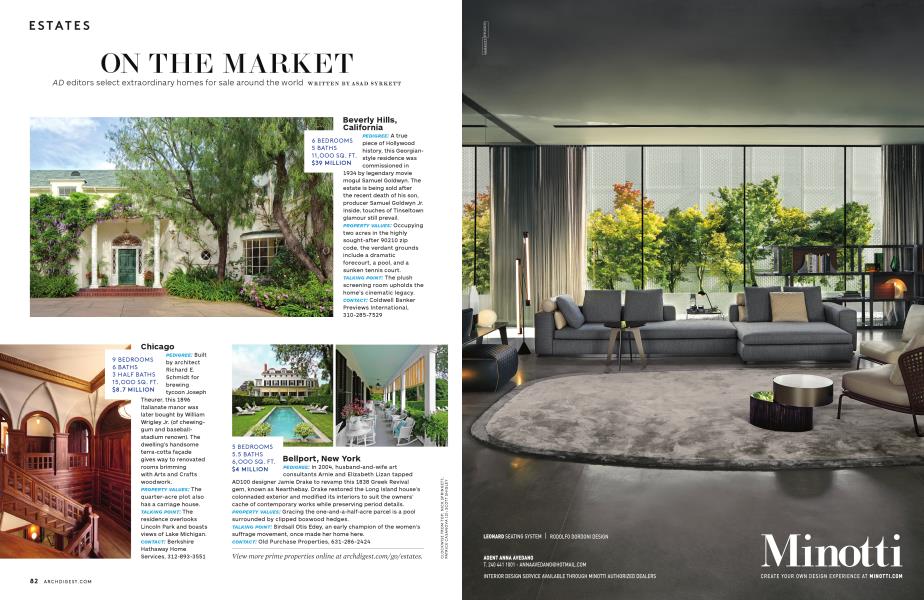
The width and height of the screenshot is (924, 600). I want to click on large vertical rectangle windows, so point(723,182), point(466,221).